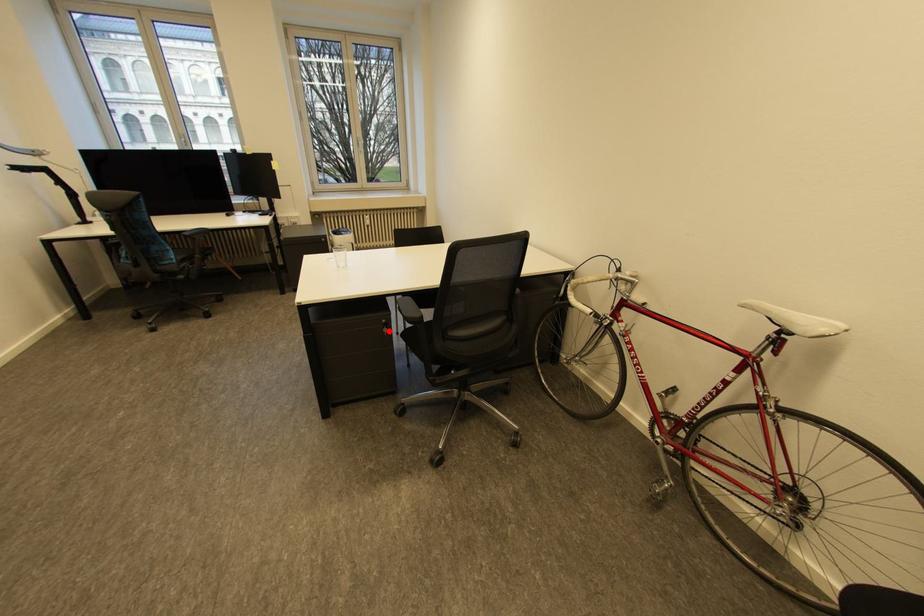
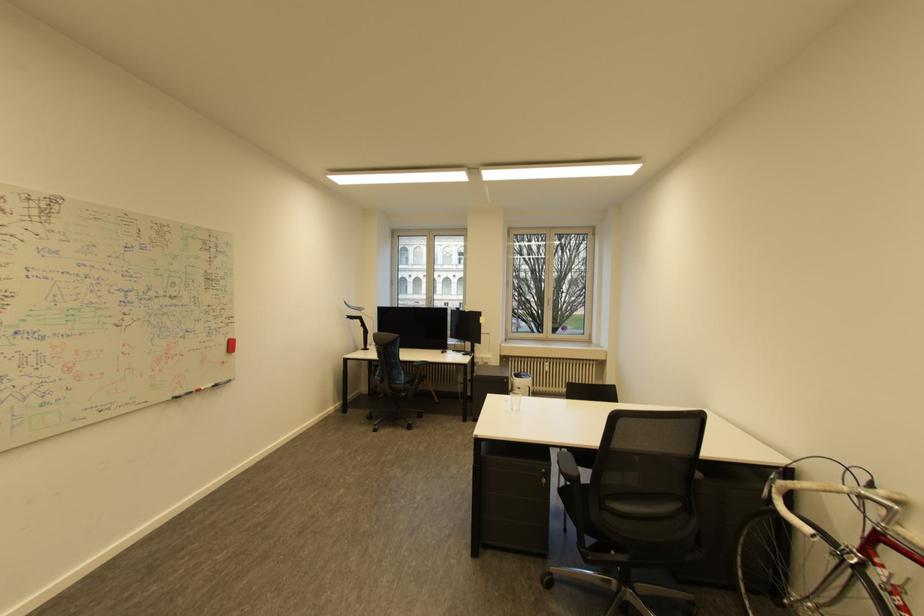
Question: I am providing you with two images of the same scene from different viewpoints. A red point is shown in image1. For the corresponding object point in image2, is it positioned nearer or farther from the camera?

Choices:
 (A) Nearer
 (B) Farther

Answer: (B)